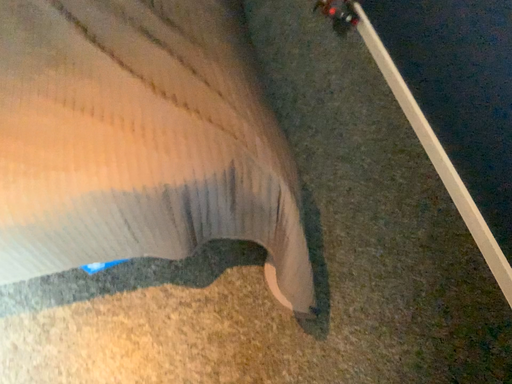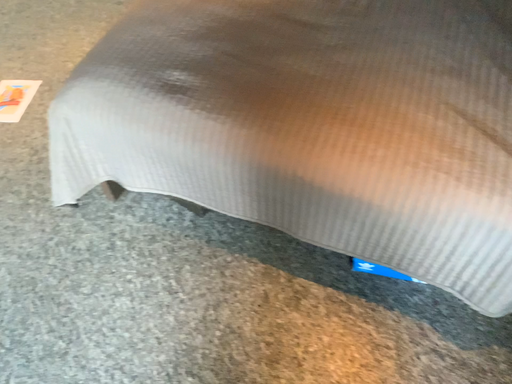
Question: How did the camera likely rotate when shooting the video?

Choices:
 (A) rotated downward
 (B) rotated upward

Answer: (B)